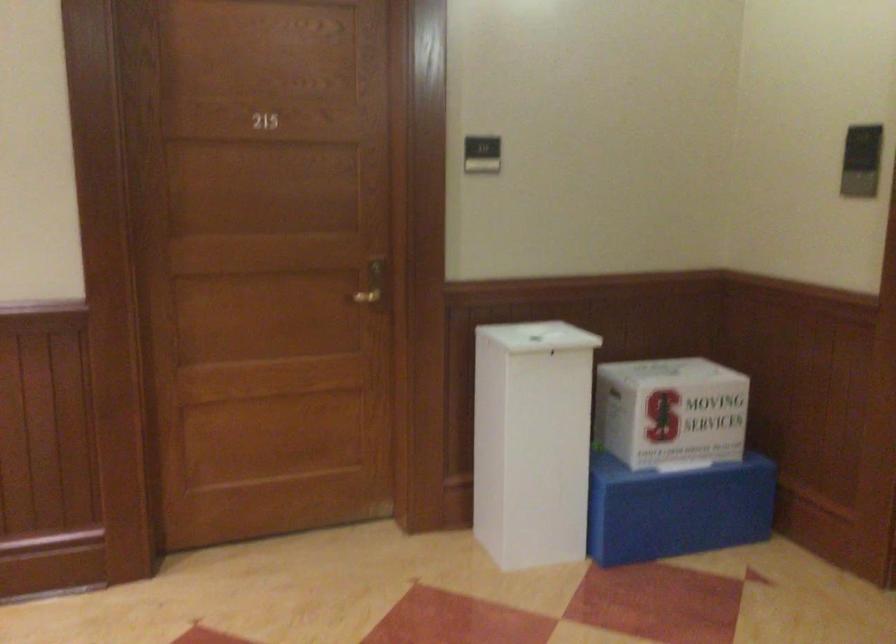
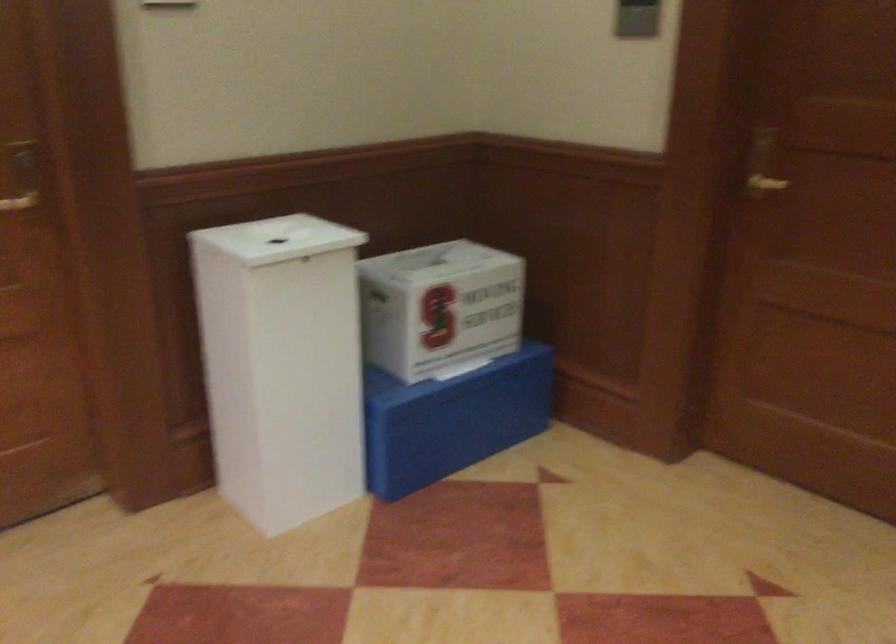
The point at (667,408) is marked in the first image. Where is the corresponding point in the second image?

(440, 307)